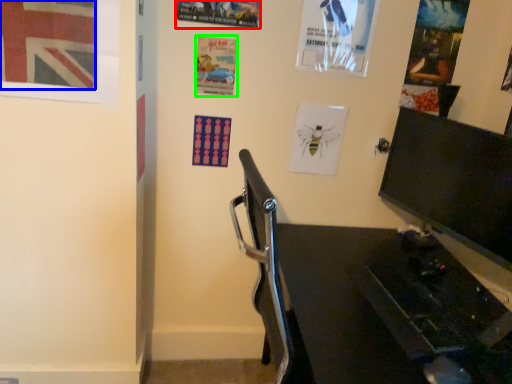
Question: Which object is positioned closest to poster page (highlighted by a red box)? Select from poster (highlighted by a blue box) and poster page (highlighted by a green box).

Choices:
 (A) poster
 (B) poster page

Answer: (B)